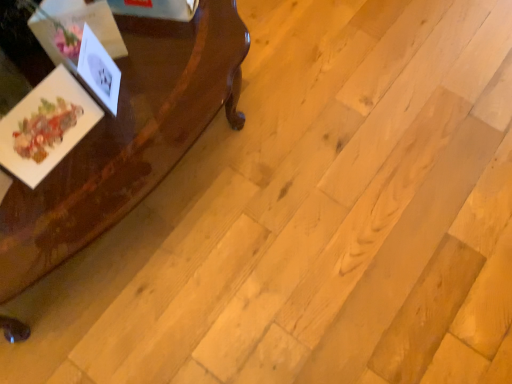
Question: Is glossy wood table at left outside matte paper postcard at left, the 1th postcard in the left-to-right sequence?

Choices:
 (A) no
 (B) yes

Answer: (B)

Question: Does glossy wood table at left appear on the left side of matte paper postcard at left, the 2th postcard in the right-to-left sequence?

Choices:
 (A) yes
 (B) no

Answer: (A)

Question: From a real-world perspective, is glossy wood table at left below matte paper postcard at left, the 1th postcard in the left-to-right sequence?

Choices:
 (A) yes
 (B) no

Answer: (A)

Question: Considering the relative sizes of glossy wood table at left and matte paper postcard at left, the 1th postcard in the left-to-right sequence, in the image provided, is glossy wood table at left thinner than matte paper postcard at left, the 1th postcard in the left-to-right sequence,?

Choices:
 (A) yes
 (B) no

Answer: (B)

Question: From the image's perspective, is glossy wood table at left over matte paper postcard at left, the 2th postcard in the right-to-left sequence?

Choices:
 (A) no
 (B) yes

Answer: (A)

Question: Considering their positions, is glossy wood table at left located in front of or behind white paper at left, which appears as the 1th postcard when viewed from the right?

Choices:
 (A) behind
 (B) front

Answer: (B)

Question: Is glossy wood table at left inside or outside of white paper at left, which appears as the 1th postcard when viewed from the right?

Choices:
 (A) inside
 (B) outside

Answer: (B)

Question: Is glossy wood table at left to the left or to the right of white paper at left, which appears as the 1th postcard when viewed from the right, in the image?

Choices:
 (A) right
 (B) left

Answer: (B)

Question: Is point (94, 216) closer or farther from the camera than point (104, 54)?

Choices:
 (A) closer
 (B) farther

Answer: (A)

Question: Based on their sizes in the image, would you say matte paper postcard at left, the 2th postcard in the right-to-left sequence, is bigger or smaller than glossy wood table at left?

Choices:
 (A) small
 (B) big

Answer: (A)

Question: Would you say matte paper postcard at left, the 1th postcard in the left-to-right sequence, is inside or outside glossy wood table at left?

Choices:
 (A) outside
 (B) inside

Answer: (A)

Question: Considering the positions of matte paper postcard at left, the 1th postcard in the left-to-right sequence, and glossy wood table at left in the image, is matte paper postcard at left, the 1th postcard in the left-to-right sequence, wider or thinner than glossy wood table at left?

Choices:
 (A) wide
 (B) thin

Answer: (B)

Question: From a real-world perspective, is matte paper postcard at left, the 2th postcard in the right-to-left sequence, physically located above or below glossy wood table at left?

Choices:
 (A) below
 (B) above

Answer: (B)

Question: Does point (80, 51) appear closer or farther from the camera than point (106, 142)?

Choices:
 (A) closer
 (B) farther

Answer: (A)

Question: From the image's perspective, relative to glossy wood table at left, is white paper at left, which appears as the 2th postcard when viewed from the left, above or below?

Choices:
 (A) above
 (B) below

Answer: (A)